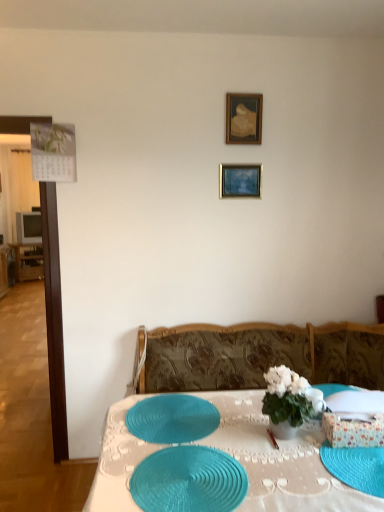
Image resolution: width=384 pixels, height=512 pixels. In order to click on blank space situated above blue textured glass plate at lower right (from a real-world perspective) in this screenshot , I will do `click(362, 455)`.